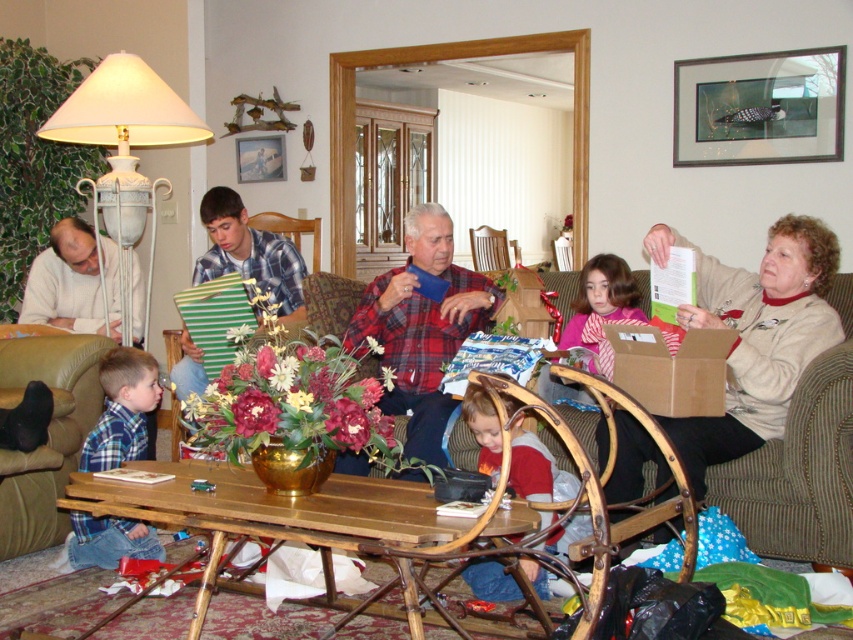
Is plaid flannel shirt at center positioned behind pink satin scarf at center?

No, plaid flannel shirt at center is closer to the viewer.

Who is positioned more to the right, plaid flannel shirt at center or pink satin scarf at center?

Positioned to the right is pink satin scarf at center.

What do you see at coordinates (422, 326) in the screenshot?
I see `plaid flannel shirt at center` at bounding box center [422, 326].

You are a GUI agent. You are given a task and a screenshot of the screen. Output one action in this format:
    pyautogui.click(x=<x>, y=<y>)
    Task: Click on the plaid flannel shirt at center
    The width and height of the screenshot is (853, 640).
    Given the screenshot: What is the action you would take?
    pyautogui.click(x=422, y=326)

Locate an element on the screen. The width and height of the screenshot is (853, 640). brown leather couch at lower left is located at coordinates (47, 433).

Is point (51, 378) less distant than point (566, 333)?

Yes, point (51, 378) is in front of point (566, 333).

Locate an element on the screen. The width and height of the screenshot is (853, 640). brown leather couch at lower left is located at coordinates (47, 433).

Is beige fabric couch at right to the left of pink satin scarf at center from the viewer's perspective?

In fact, beige fabric couch at right is to the right of pink satin scarf at center.

You are a GUI agent. You are given a task and a screenshot of the screen. Output one action in this format:
    pyautogui.click(x=<x>, y=<y>)
    Task: Click on the beige fabric couch at right
    
    Given the screenshot: What is the action you would take?
    pyautogui.click(x=759, y=339)

Where is `beige fabric couch at right`? The width and height of the screenshot is (853, 640). beige fabric couch at right is located at coordinates (759, 339).